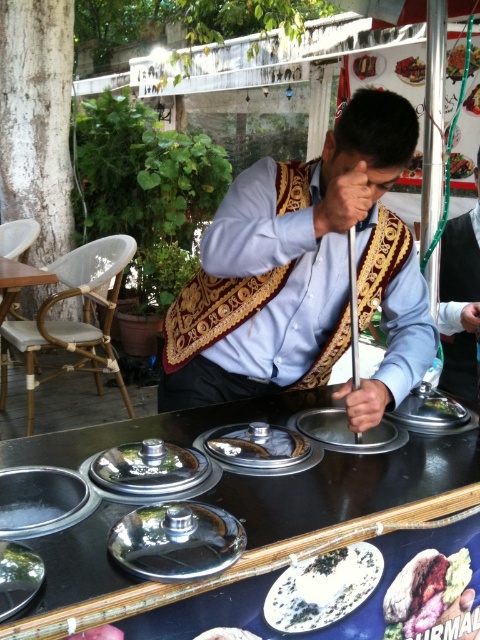
Question: Is matte gold vest at center thinner than white wood table at left?

Choices:
 (A) yes
 (B) no

Answer: (A)

Question: Is shiny metallic lid at center positioned in front of smooth white rice at center?

Choices:
 (A) no
 (B) yes

Answer: (B)

Question: Considering the real-world distances, which object is farthest from the green leafy vegetable at center?

Choices:
 (A) shiny silver plate at lower left
 (B) white glossy stick at center
 (C) smooth red sauce at upper right
 (D) white fluffy bread at center

Answer: (B)

Question: In this image, where is embroidered fabric vest at center located relative to white glossy stick at center?

Choices:
 (A) left
 (B) right

Answer: (B)

Question: Which point is closer to the camera?

Choices:
 (A) (309, 596)
 (B) (20, 284)

Answer: (A)

Question: Which point is farther to the camera?

Choices:
 (A) embroidered fabric vest at center
 (B) matte gold vest at center

Answer: (B)